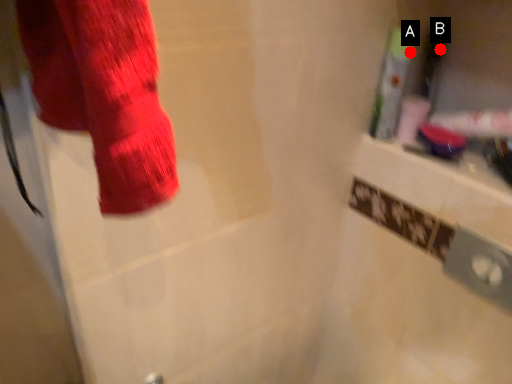
Question: Two points are circled on the image, labeled by A and B beside each circle. Which point is closer to the camera?

Choices:
 (A) A is closer
 (B) B is closer

Answer: (A)